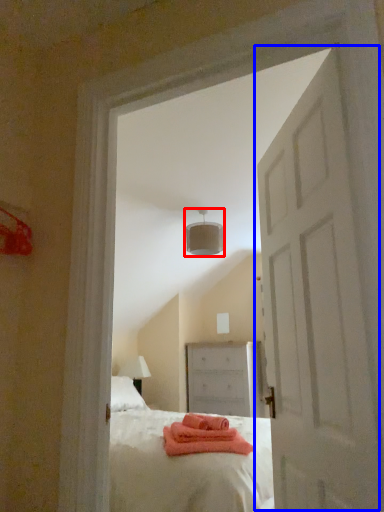
Question: Among these objects, which one is nearest to the camera, lamp (highlighted by a red box) or door (highlighted by a blue box)?

Choices:
 (A) lamp
 (B) door

Answer: (B)